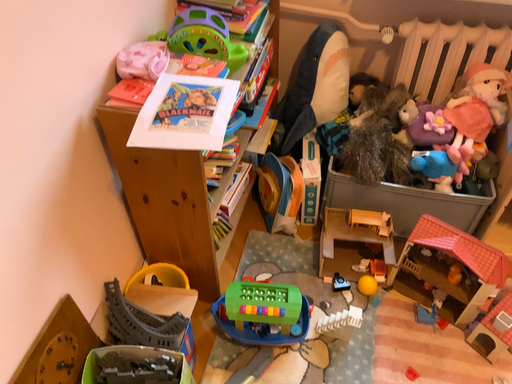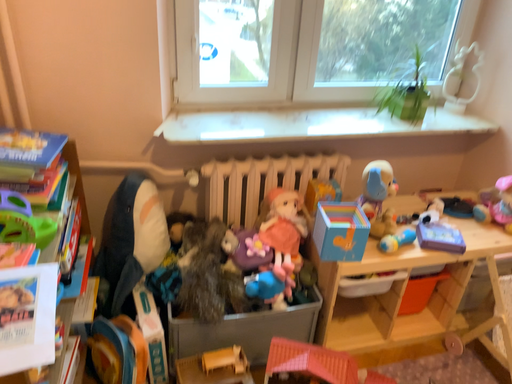
Question: How did the camera likely rotate when shooting the video?

Choices:
 (A) rotated downward
 (B) rotated upward

Answer: (B)